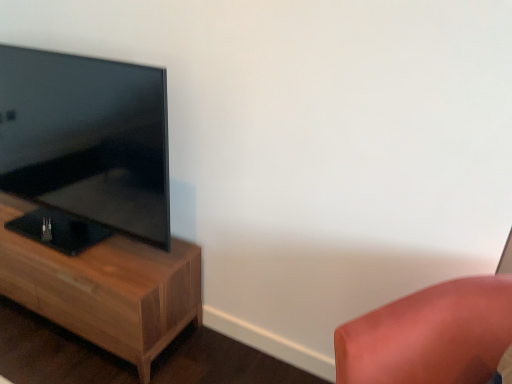
Question: Considering the relative sizes of matte black tv at left and satin pink cushion at lower right in the image provided, is matte black tv at left thinner than satin pink cushion at lower right?

Choices:
 (A) yes
 (B) no

Answer: (A)

Question: Does matte black tv at left have a larger size compared to satin pink cushion at lower right?

Choices:
 (A) no
 (B) yes

Answer: (B)

Question: From a real-world perspective, is matte black tv at left under satin pink cushion at lower right?

Choices:
 (A) no
 (B) yes

Answer: (A)

Question: From a real-world perspective, is matte black tv at left physically above satin pink cushion at lower right?

Choices:
 (A) yes
 (B) no

Answer: (A)

Question: From the image's perspective, does matte black tv at left appear higher than satin pink cushion at lower right?

Choices:
 (A) yes
 (B) no

Answer: (A)

Question: Are matte black tv at left and satin pink cushion at lower right making contact?

Choices:
 (A) yes
 (B) no

Answer: (B)

Question: From a real-world perspective, is wooden nightstand at left under satin pink cushion at lower right?

Choices:
 (A) yes
 (B) no

Answer: (A)

Question: Is wooden nightstand at left oriented towards satin pink cushion at lower right?

Choices:
 (A) yes
 (B) no

Answer: (B)

Question: Would you say wooden nightstand at left contains satin pink cushion at lower right?

Choices:
 (A) no
 (B) yes

Answer: (A)

Question: Can you confirm if wooden nightstand at left is bigger than satin pink cushion at lower right?

Choices:
 (A) yes
 (B) no

Answer: (A)

Question: From the image's perspective, does wooden nightstand at left appear lower than satin pink cushion at lower right?

Choices:
 (A) yes
 (B) no

Answer: (B)

Question: From the image's perspective, is wooden nightstand at left over satin pink cushion at lower right?

Choices:
 (A) no
 (B) yes

Answer: (B)

Question: Is wooden nightstand at left far from matte black tv at left?

Choices:
 (A) yes
 (B) no

Answer: (B)